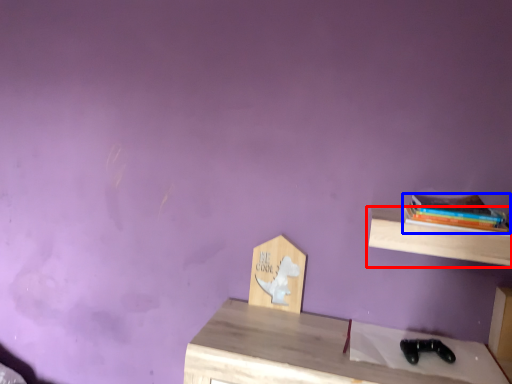
Question: Which object appears closest to the camera in this image, shelf (highlighted by a red box) or book (highlighted by a blue box)?

Choices:
 (A) shelf
 (B) book

Answer: (A)